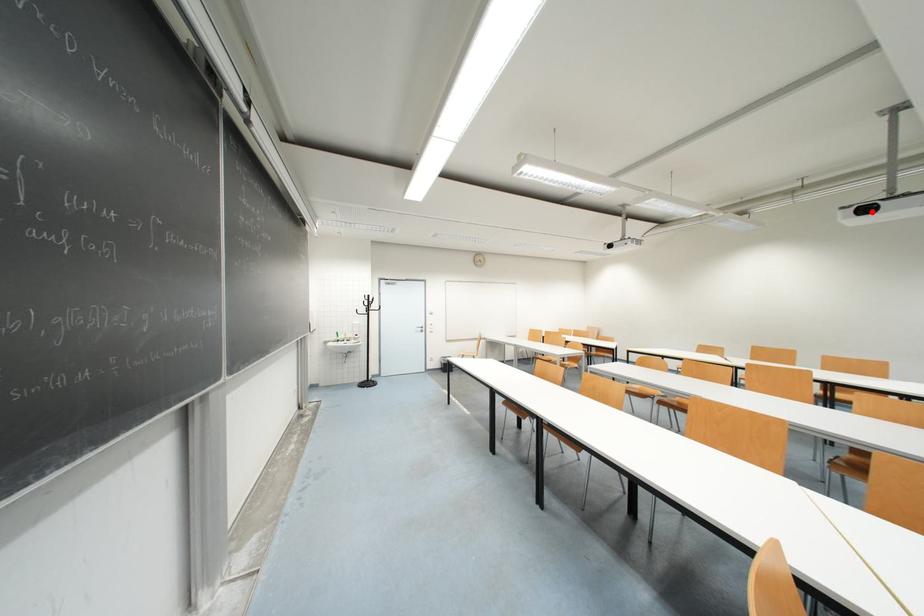
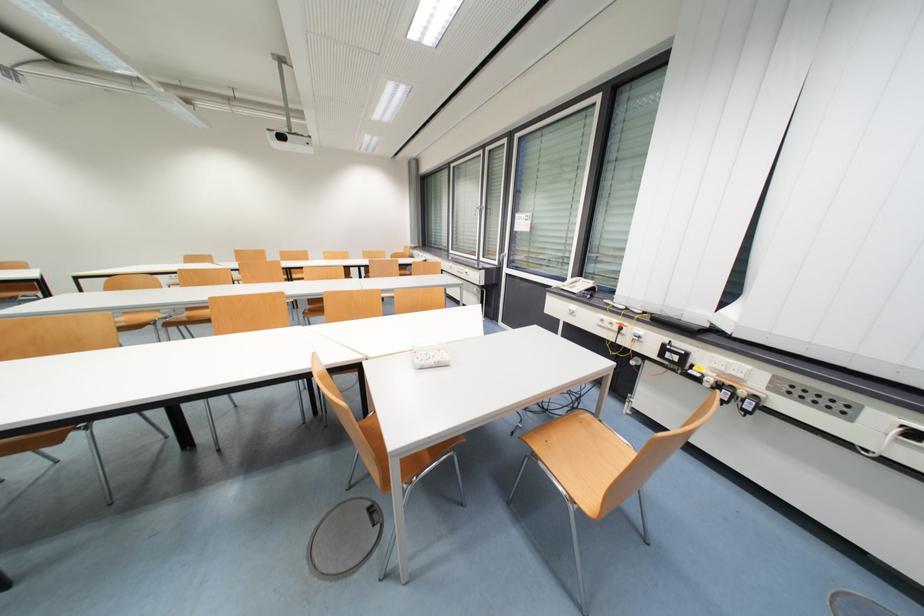
Question: I am providing you with two images of the same scene from different viewpoints. In image1, a red point is highlighted. Considering the same 3D point in image2, which of the following is correct?

Choices:
 (A) It is closer
 (B) It is farther

Answer: (A)